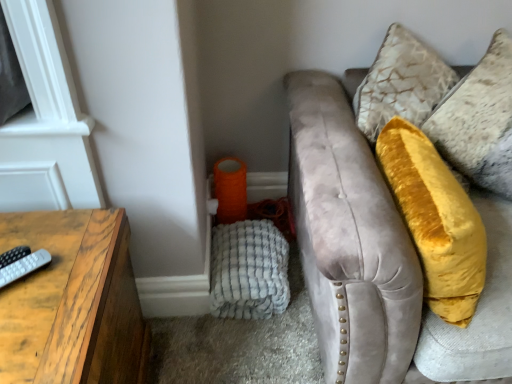
Question: Considering the relative sizes of gray matte remote at left and velvet gray studio couch at right in the image provided, is gray matte remote at left wider than velvet gray studio couch at right?

Choices:
 (A) no
 (B) yes

Answer: (A)

Question: Is gray matte remote at left further to the viewer compared to velvet gray studio couch at right?

Choices:
 (A) no
 (B) yes

Answer: (B)

Question: From the image's perspective, does gray matte remote at left appear lower than velvet gray studio couch at right?

Choices:
 (A) yes
 (B) no

Answer: (A)

Question: From a real-world perspective, is gray matte remote at left physically below velvet gray studio couch at right?

Choices:
 (A) no
 (B) yes

Answer: (A)

Question: Could you tell me if gray matte remote at left is facing velvet gray studio couch at right?

Choices:
 (A) no
 (B) yes

Answer: (A)

Question: Would you say gray matte remote at left contains velvet gray studio couch at right?

Choices:
 (A) yes
 (B) no

Answer: (B)

Question: Is white textured blanket at lower left turned away from wooden table at left?

Choices:
 (A) no
 (B) yes

Answer: (A)

Question: Is white textured blanket at lower left in front of wooden table at left?

Choices:
 (A) yes
 (B) no

Answer: (B)

Question: From a real-world perspective, is white textured blanket at lower left below wooden table at left?

Choices:
 (A) no
 (B) yes

Answer: (B)

Question: Does white textured blanket at lower left turn towards wooden table at left?

Choices:
 (A) no
 (B) yes

Answer: (A)

Question: Considering the relative sizes of white textured blanket at lower left and wooden table at left in the image provided, is white textured blanket at lower left bigger than wooden table at left?

Choices:
 (A) no
 (B) yes

Answer: (A)

Question: Is white textured blanket at lower left at the left side of wooden table at left?

Choices:
 (A) no
 (B) yes

Answer: (A)

Question: From a real-world perspective, is gray matte remote at left under velvet yellow pillow at upper right?

Choices:
 (A) yes
 (B) no

Answer: (A)